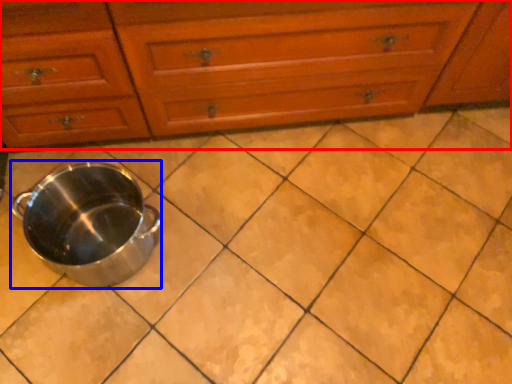
Question: Which object appears farthest to the camera in this image, chest of drawers (highlighted by a red box) or crock pot (highlighted by a blue box)?

Choices:
 (A) chest of drawers
 (B) crock pot

Answer: (B)